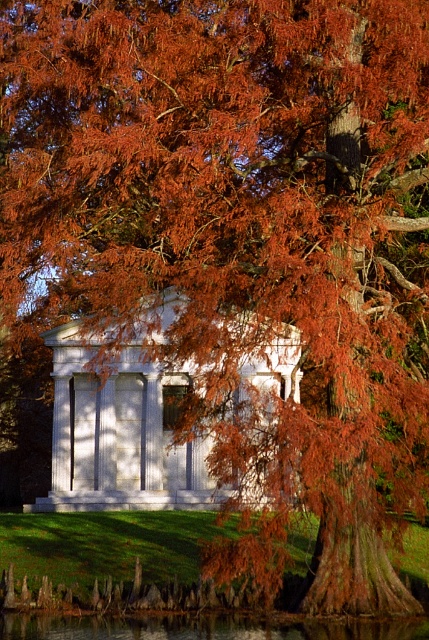
Question: Does white marble gazebo at center appear on the right side of transparent water at lower center?

Choices:
 (A) yes
 (B) no

Answer: (A)

Question: Is white marble gazebo at center to the right of transparent water at lower center from the viewer's perspective?

Choices:
 (A) yes
 (B) no

Answer: (A)

Question: Which of the following is the farthest from the observer?

Choices:
 (A) (178, 394)
 (B) (0, 627)

Answer: (A)

Question: Where is white marble gazebo at center located in relation to transparent water at lower center in the image?

Choices:
 (A) above
 (B) below

Answer: (A)